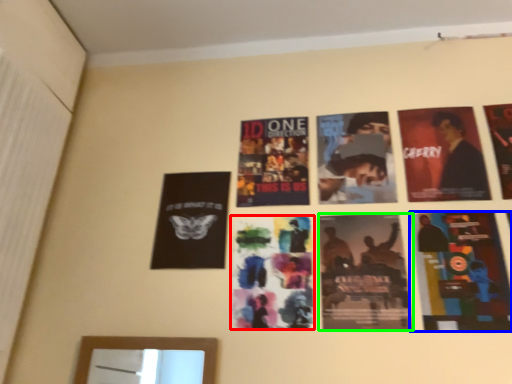
Question: Estimate the real-world distances between objects in this image. Which object is closer to poster (highlighted by a red box), poster (highlighted by a blue box) or poster (highlighted by a green box)?

Choices:
 (A) poster
 (B) poster

Answer: (B)